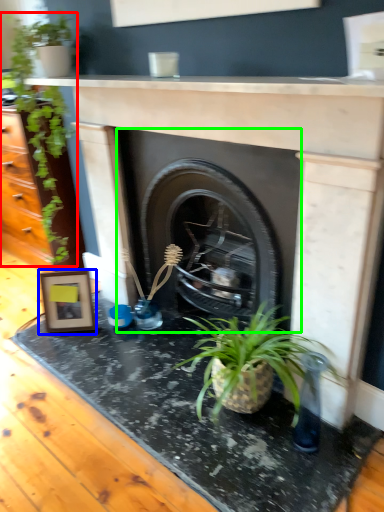
Question: Considering the real-world distances, which object is closest to houseplant (highlighted by a red box)? picture frame (highlighted by a blue box) or fireplace (highlighted by a green box).

Choices:
 (A) picture frame
 (B) fireplace

Answer: (A)